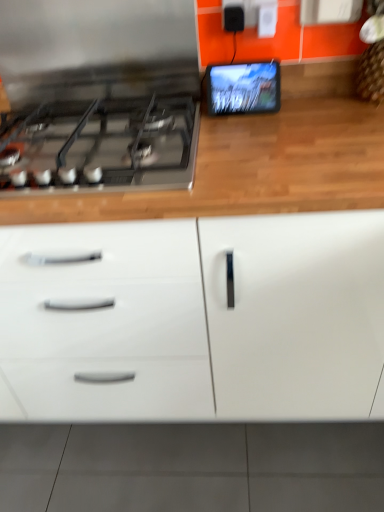
What do you see at coordinates (197, 320) in the screenshot?
I see `white glossy cabinet at center` at bounding box center [197, 320].

Locate an element on the screen. The width and height of the screenshot is (384, 512). white glossy cabinet at center is located at coordinates (197, 320).

Is satin black gas stove at left positioned with its back to matte black tablet at upper right?

satin black gas stove at left does not have its back to matte black tablet at upper right.

Who is shorter, satin black gas stove at left or matte black tablet at upper right?

satin black gas stove at left.

Is satin black gas stove at left further to camera compared to matte black tablet at upper right?

No, it is in front of matte black tablet at upper right.

Is matte black tablet at upper right taller than satin black gas stove at left?

Yes, matte black tablet at upper right is taller than satin black gas stove at left.

From a real-world perspective, is matte black tablet at upper right above or below satin black gas stove at left?

matte black tablet at upper right is above satin black gas stove at left.

What's the angular difference between matte black tablet at upper right and satin black gas stove at left's facing directions?

The facing directions of matte black tablet at upper right and satin black gas stove at left are 1.35 degrees apart.

From a real-world perspective, is satin black gas stove at left positioned under white glossy cabinet at center based on gravity?

Incorrect, from a real-world perspective, satin black gas stove at left is higher than white glossy cabinet at center.

Considering the relative positions of satin black gas stove at left and white glossy cabinet at center in the image provided, is satin black gas stove at left to the right of white glossy cabinet at center from the viewer's perspective?

No.

Who is smaller, satin black gas stove at left or white glossy cabinet at center?

satin black gas stove at left.

Is satin black gas stove at left inside the boundaries of white glossy cabinet at center, or outside?

satin black gas stove at left can be found inside white glossy cabinet at center.

Is white glossy cabinet at center shorter than satin black gas stove at left?

No.

Does white glossy cabinet at center turn towards satin black gas stove at left?

Yes, white glossy cabinet at center faces towards satin black gas stove at left.

Visually, is white glossy cabinet at center positioned to the left or to the right of satin black gas stove at left?

In the image, white glossy cabinet at center appears on the right side of satin black gas stove at left.

Which of these two, matte black tablet at upper right or white glossy cabinet at center, stands taller?

Standing taller between the two is white glossy cabinet at center.

From a real-world perspective, which is physically below, matte black tablet at upper right or white glossy cabinet at center?

white glossy cabinet at center, from a real-world perspective.

Does point (250, 83) come farther from viewer compared to point (270, 290)?

Yes, point (250, 83) is farther from viewer.

Is white glossy cabinet at center turned away from matte black tablet at upper right?

That's right, white glossy cabinet at center is facing away from matte black tablet at upper right.

Consider the image. Would you say white glossy cabinet at center is a long distance from matte black tablet at upper right?

No, there isn't a large distance between white glossy cabinet at center and matte black tablet at upper right.

Considering the relative sizes of white glossy cabinet at center and matte black tablet at upper right in the image provided, is white glossy cabinet at center smaller than matte black tablet at upper right?

No, white glossy cabinet at center is not smaller than matte black tablet at upper right.

From the image's perspective, between white glossy cabinet at center and matte black tablet at upper right, which one is located above?

From the image's view, matte black tablet at upper right is above.

Locate an element on the screen. gas stove below the matte black tablet at upper right (from a real-world perspective) is located at coordinates click(101, 145).

This screenshot has width=384, height=512. What are the coordinates of `gas stove located below the matte black tablet at upper right (from the image's perspective)` in the screenshot? It's located at (101, 145).

Based on the photo, from the image, which object appears to be nearer to matte black tablet at upper right, white glossy cabinet at center or satin black gas stove at left?

Among the two, satin black gas stove at left is located nearer to matte black tablet at upper right.

Estimate the real-world distances between objects in this image. Which object is closer to satin black gas stove at left, matte black tablet at upper right or white glossy cabinet at center?

matte black tablet at upper right is closer to satin black gas stove at left.

Based on their spatial positions, is satin black gas stove at left or matte black tablet at upper right closer to white glossy cabinet at center?

satin black gas stove at left is positioned closer to the anchor white glossy cabinet at center.

Which object lies nearer to the anchor point satin black gas stove at left, white glossy cabinet at center or matte black tablet at upper right?

Based on the image, matte black tablet at upper right appears to be nearer to satin black gas stove at left.

Estimate the real-world distances between objects in this image. Which object is further from white glossy cabinet at center, matte black tablet at upper right or satin black gas stove at left?

The object further to white glossy cabinet at center is matte black tablet at upper right.

Looking at the image, which one is located further to matte black tablet at upper right, satin black gas stove at left or white glossy cabinet at center?

white glossy cabinet at center.

The height and width of the screenshot is (512, 384). I want to click on gas stove between matte black tablet at upper right and white glossy cabinet at center vertically, so coord(101,145).